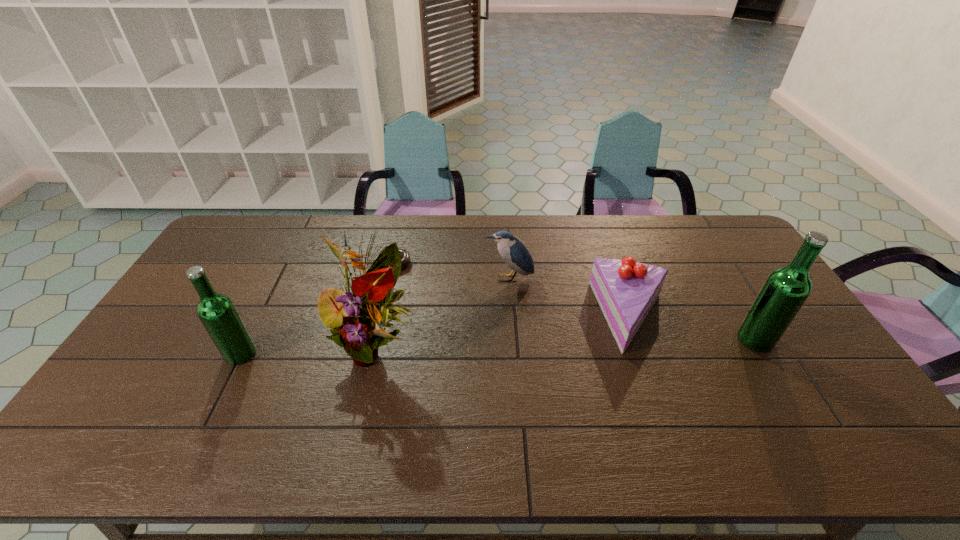
This screenshot has width=960, height=540. Identify the location of the left beer bottle. (218, 314).

The width and height of the screenshot is (960, 540). In order to click on the leftmost object in this screenshot , I will do `click(218, 314)`.

Where is `the taller beer bottle`? This screenshot has height=540, width=960. the taller beer bottle is located at coordinates (786, 289).

Image resolution: width=960 pixels, height=540 pixels. Identify the location of the rightmost object. (786, 289).

Image resolution: width=960 pixels, height=540 pixels. I want to click on the shortest object, so [405, 256].

This screenshot has width=960, height=540. Find the location of `cake`. cake is located at coordinates (626, 290).

Locate an element on the screen. The width and height of the screenshot is (960, 540). the second object from right to left is located at coordinates (626, 290).

I want to click on the third object from right to left, so click(512, 250).

This screenshot has width=960, height=540. Find the location of `bird`. bird is located at coordinates (512, 250).

Where is `bouquet`? This screenshot has height=540, width=960. bouquet is located at coordinates (356, 326).